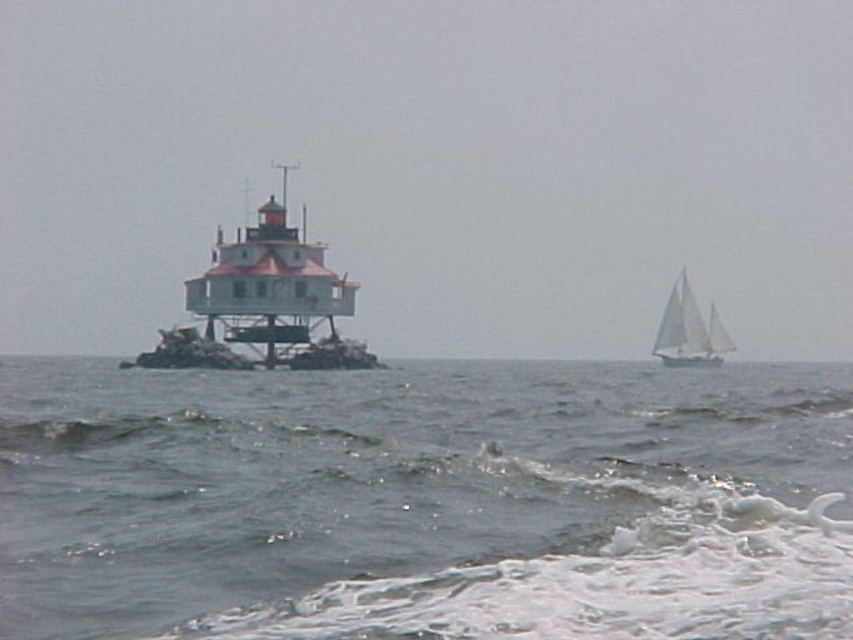
Question: Considering the relative positions of white painted wood lighthouse at center and white sailboat at right in the image provided, where is white painted wood lighthouse at center located with respect to white sailboat at right?

Choices:
 (A) below
 (B) above

Answer: (B)

Question: Which of these objects is positioned farthest from the gray water at center?

Choices:
 (A) white sailboat at right
 (B) white painted wood lighthouse at center

Answer: (A)

Question: Is white painted wood lighthouse at center positioned at the back of white sailboat at right?

Choices:
 (A) yes
 (B) no

Answer: (B)

Question: Which of the following is the closest to the observer?

Choices:
 (A) white sailboat at right
 (B) gray water at center
 (C) white painted wood lighthouse at center

Answer: (B)

Question: Which point appears closest to the camera in this image?

Choices:
 (A) (294, 236)
 (B) (593, 426)
 (C) (651, 349)

Answer: (B)

Question: Can you confirm if white painted wood lighthouse at center is bigger than white sailboat at right?

Choices:
 (A) no
 (B) yes

Answer: (B)